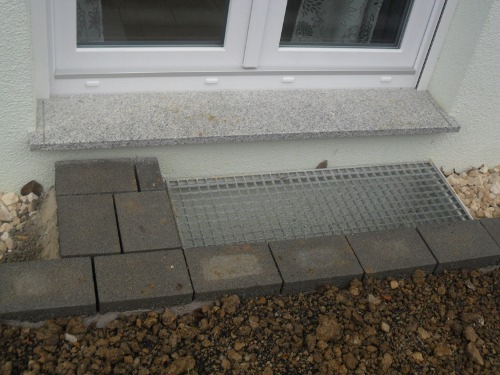
Where is `stucco walls`? The width and height of the screenshot is (500, 375). stucco walls is located at coordinates (x=13, y=99), (x=477, y=89), (x=252, y=157).